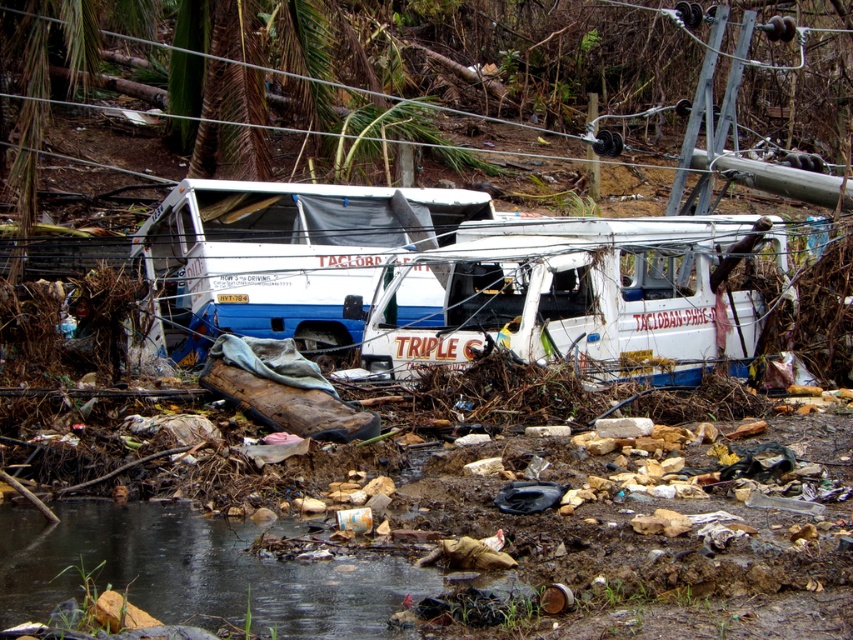
You are a city planner analyzing the layout of this abandoned area. You need to place a new recycling bin. The bin must be placed exactly at the coordinates of the white matte van at center. What are the coordinates where you should place the recycling bin?

The coordinates for the white matte van at center are (581,294). Therefore, the recycling bin should be placed at point (581,294).

Please use the coordinate system where the origin is at the bottom left corner of the image. The white matte van at center is located at point [581,294]. If you were standing at the origin point, which direction would you need to move to reach the white matte van at center?

To reach the white matte van at center from the origin point at the bottom left corner, you would need to move towards the upper right direction since the van is located at coordinates [581,294]. The x and y values both being greater than zero indicate movement to the right and upwards respectively.

You are a rescue worker assessing the scene. You need to determine if the white matte van at center can be accessed from the translucent murky water at lower center. Can you walk from the water to the van?

The white matte van at center is taller than the translucent murky water at lower center, meaning the water level is lower than the van. Therefore, you can walk from the translucent murky water at lower center to the white matte van at center since the water does not obstruct the path.